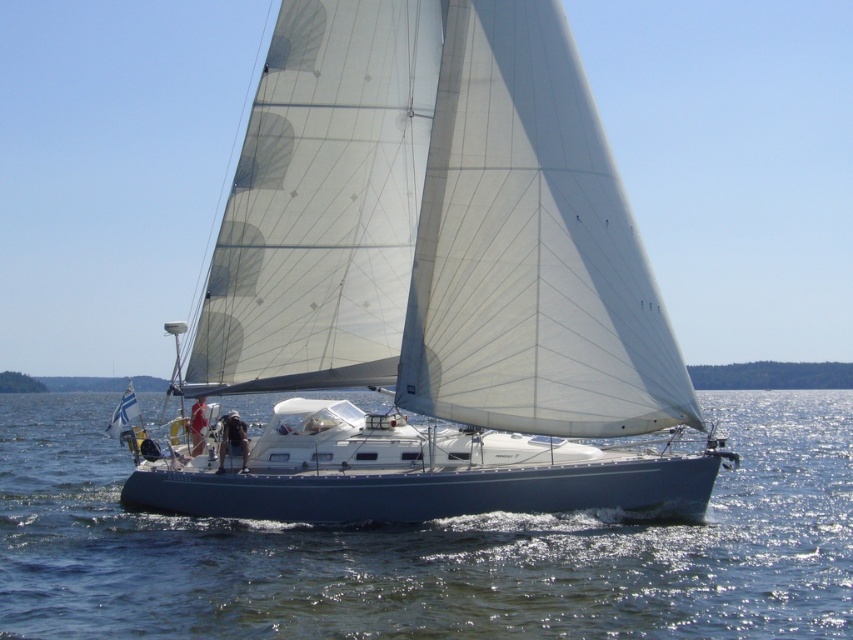
You are standing on the deck of a cruise ship that is 100 feet away from the white matte sailboat at center. You want to take a photo of the sailboat using a camera with a 50mm lens. Considering the distance, will the camera need to be zoomed in to capture the entire sailboat in the frame?

The white matte sailboat at center is 68.89 feet away from the camera. Since the cruise ship is 100 feet away, the total distance is 168.89 feet. A 50mm lens typically has a field of view that can capture subjects at this distance without needing significant zoom. However, to ensure the entire sailboat fits, slight zoom might be necessary depending on the sailboat size and camera sensor. But based on standard calculations, the 50mm lens should suffice without excessive zoom.

You are a drone operator trying to capture a photo of the white matte sailboat at center. Your drone is currently at the point with coordinates point (x=438, y=227). Is the drone positioned correctly to take a clear photo of the white matte sailboat at center?

The white matte sailboat at center is represented by point (x=438, y=227), so yes, the drone is positioned correctly at point (x=438, y=227) to take a clear photo of the white matte sailboat at center.

You are a passenger on the white matte sailboat at center and want to jump into the clear blue water at center. Is the water directly in front of you or behind you?

The white matte sailboat at center is further to the viewer than clear blue water at center, so the water is behind the boat. Therefore, the clear blue water at center is behind the white matte sailboat at center, so you would need to move towards the back of the boat to jump into the water.